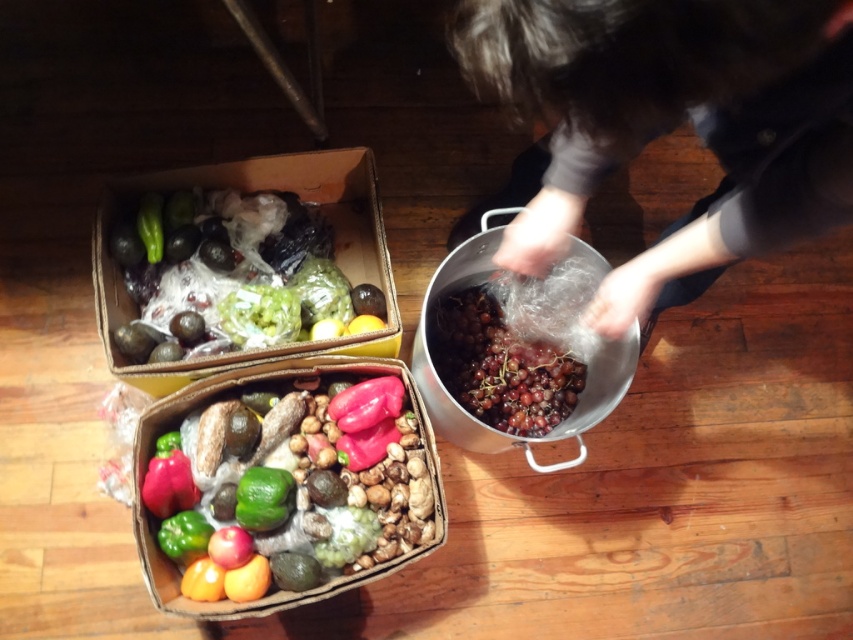
Does shiny plastic peppers at center appear under shiny purple grapes at center?

Indeed, shiny plastic peppers at center is positioned under shiny purple grapes at center.

Is shiny plastic peppers at center taller than shiny purple grapes at center?

Yes.

Identify the location of shiny plastic peppers at center. (296, 476).

Between point (338, 492) and point (190, 500), which one is positioned behind?

The point (190, 500) is behind.

Describe the element at coordinates (296, 476) in the screenshot. The height and width of the screenshot is (640, 853). I see `shiny plastic peppers at center` at that location.

In order to click on shiny plastic peppers at center in this screenshot , I will do `click(296, 476)`.

Who is higher up, smooth plastic bag at center or green matte lime at lower center?

Positioned higher is smooth plastic bag at center.

Image resolution: width=853 pixels, height=640 pixels. What do you see at coordinates (672, 124) in the screenshot?
I see `smooth plastic bag at center` at bounding box center [672, 124].

The width and height of the screenshot is (853, 640). I want to click on smooth plastic bag at center, so click(x=672, y=124).